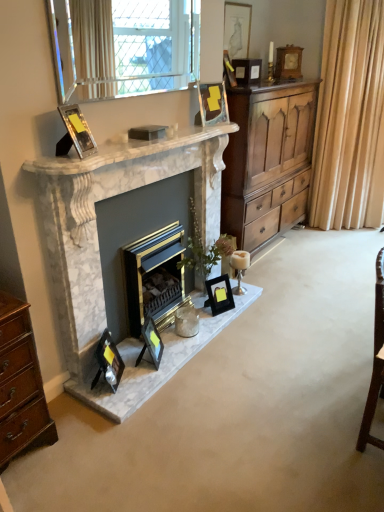
Question: Considering the relative positions of white marble fireplace at upper center and white glass candle holder at lower center in the image provided, is white marble fireplace at upper center behind white glass candle holder at lower center?

Choices:
 (A) no
 (B) yes

Answer: (A)

Question: Considering the relative sizes of white marble fireplace at upper center and white glass candle holder at lower center in the image provided, is white marble fireplace at upper center shorter than white glass candle holder at lower center?

Choices:
 (A) no
 (B) yes

Answer: (B)

Question: From a real-world perspective, is white marble fireplace at upper center under white glass candle holder at lower center?

Choices:
 (A) yes
 (B) no

Answer: (B)

Question: Is white glass candle holder at lower center completely or partially inside white marble fireplace at upper center?

Choices:
 (A) yes
 (B) no

Answer: (B)

Question: Is white marble fireplace at upper center oriented towards white glass candle holder at lower center?

Choices:
 (A) no
 (B) yes

Answer: (A)

Question: In terms of height, does matte black picture frame at lower left, which appears as the 1th picture frame when ordered from the bottom, look taller or shorter compared to wooden picture frame at upper right, the 2th picture frame positioned from the top?

Choices:
 (A) short
 (B) tall

Answer: (B)

Question: Considering the positions of matte black picture frame at lower left, which appears as the 1th picture frame when ordered from the bottom, and wooden picture frame at upper right, acting as the first picture frame starting from the back, in the image, is matte black picture frame at lower left, which appears as the 1th picture frame when ordered from the bottom, wider or thinner than wooden picture frame at upper right, acting as the first picture frame starting from the back,?

Choices:
 (A) thin
 (B) wide

Answer: (A)

Question: Is point (104, 342) closer or farther from the camera than point (299, 67)?

Choices:
 (A) farther
 (B) closer

Answer: (B)

Question: Choose the correct answer: Is matte black picture frame at lower left, which is counted as the second picture frame, starting from the front, inside wooden picture frame at upper right, the 2th picture frame positioned from the top, or outside it?

Choices:
 (A) outside
 (B) inside

Answer: (A)

Question: Considering the positions of matte black picture frame at lower center, the second picture frame from the bottom, and white glass candle holder at lower center in the image, is matte black picture frame at lower center, the second picture frame from the bottom, bigger or smaller than white glass candle holder at lower center?

Choices:
 (A) small
 (B) big

Answer: (B)

Question: Is matte black picture frame at lower center, which ranks as the 3th picture frame in front-to-back order, in front of or behind white glass candle holder at lower center in the image?

Choices:
 (A) front
 (B) behind

Answer: (A)

Question: Is matte black picture frame at lower center, the 3th picture frame positioned from the left, spatially inside white glass candle holder at lower center, or outside of it?

Choices:
 (A) inside
 (B) outside

Answer: (B)

Question: From a real-world perspective, is matte black picture frame at lower center, the 6th picture frame from the top, physically located above or below white glass candle holder at lower center?

Choices:
 (A) above
 (B) below

Answer: (B)

Question: From a real-world perspective, is matte black picture frame at upper center, which is the second picture frame from back to front, positioned above or below matte black picture frame at upper center, the fourth picture frame positioned from the back?

Choices:
 (A) below
 (B) above

Answer: (B)

Question: Considering the positions of matte black picture frame at upper center, acting as the seventh picture frame starting from the bottom, and matte black picture frame at upper center, placed as the fourth picture frame when sorted from front to back, in the image, is matte black picture frame at upper center, acting as the seventh picture frame starting from the bottom, bigger or smaller than matte black picture frame at upper center, placed as the fourth picture frame when sorted from front to back,?

Choices:
 (A) small
 (B) big

Answer: (B)